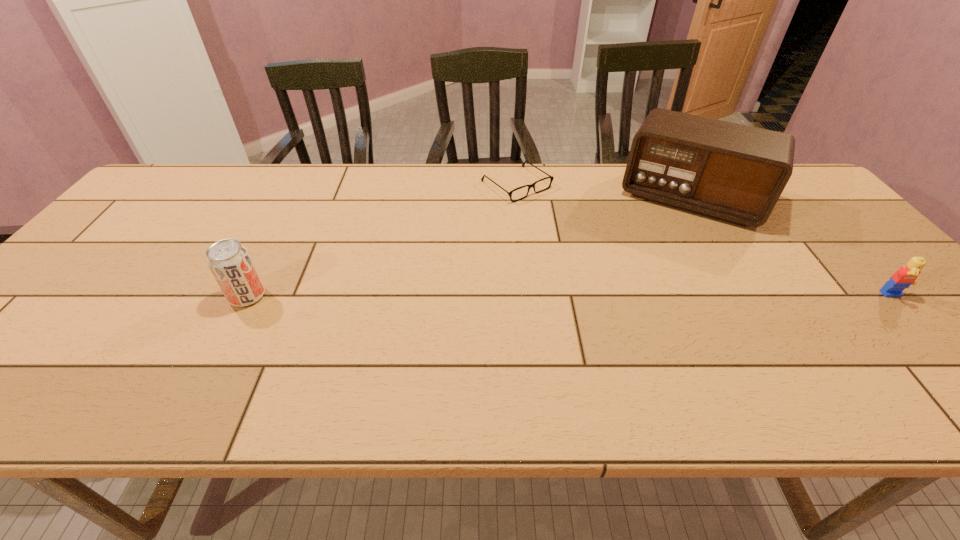
Find the location of a particular element. This screenshot has width=960, height=540. the leftmost object is located at coordinates point(229,261).

Locate an element on the screen. The width and height of the screenshot is (960, 540). the second tallest object is located at coordinates (229, 261).

At what (x,y) coordinates should I click in order to perform the action: click on the third tallest object. Please return your answer as a coordinate pair (x, y). Looking at the image, I should click on (904, 277).

Identify the location of Lego. (904, 277).

You are a GUI agent. You are given a task and a screenshot of the screen. Output one action in this format:
    pyautogui.click(x=<x>, y=<y>)
    Task: Click on the second object from left to right
    
    Given the screenshot: What is the action you would take?
    pyautogui.click(x=551, y=177)

This screenshot has height=540, width=960. What are the coordinates of `the shortest object` in the screenshot? It's located at (551, 177).

The height and width of the screenshot is (540, 960). Identify the location of the third object from left to right. coord(735,173).

Find the location of `the tallest object`. the tallest object is located at coordinates (735, 173).

Where is `vacant space situated 0.250m on the back of the third shortest object`? vacant space situated 0.250m on the back of the third shortest object is located at coordinates (286, 221).

Image resolution: width=960 pixels, height=540 pixels. What are the coordinates of `blank area located 0.050m on the face of the Lego` in the screenshot? It's located at (916, 320).